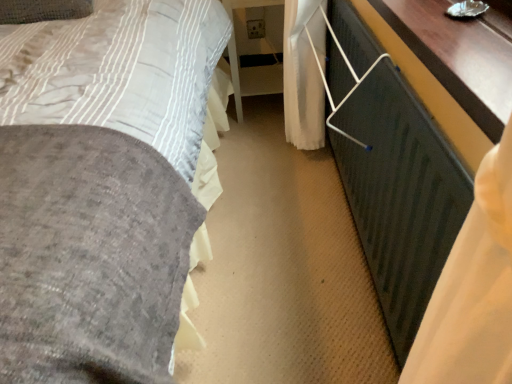
Question: Considering the relative positions of metallic silver balustrade at lower right and wooden table at right, which is the 2th table in left-to-right order, in the image provided, is metallic silver balustrade at lower right to the left of wooden table at right, which is the 2th table in left-to-right order, from the viewer's perspective?

Choices:
 (A) no
 (B) yes

Answer: (B)

Question: Does metallic silver balustrade at lower right turn towards wooden table at right, placed as the 1th table when sorted from front to back?

Choices:
 (A) no
 (B) yes

Answer: (A)

Question: Considering the relative sizes of metallic silver balustrade at lower right and wooden table at right, the first table when ordered from right to left, in the image provided, is metallic silver balustrade at lower right shorter than wooden table at right, the first table when ordered from right to left,?

Choices:
 (A) no
 (B) yes

Answer: (A)

Question: Is metallic silver balustrade at lower right positioned beyond the bounds of wooden table at right, which appears as the 2th table when viewed from the back?

Choices:
 (A) no
 (B) yes

Answer: (B)

Question: Is metallic silver balustrade at lower right closer to the viewer compared to wooden table at right, which is the 2th table in left-to-right order?

Choices:
 (A) no
 (B) yes

Answer: (B)

Question: Would you say metallic silver balustrade at lower right contains wooden table at right, the first table when ordered from right to left?

Choices:
 (A) yes
 (B) no

Answer: (B)

Question: From a real-world perspective, is white glossy table at center, the 1th table in the left-to-right sequence, positioned over wooden table at right, placed as the 1th table when sorted from front to back, based on gravity?

Choices:
 (A) no
 (B) yes

Answer: (A)

Question: Is white glossy table at center, the second table in the right-to-left sequence, shorter than wooden table at right, which is the 2th table in left-to-right order?

Choices:
 (A) no
 (B) yes

Answer: (A)

Question: Can you confirm if white glossy table at center, the 2th table when ordered from front to back, is smaller than wooden table at right, which is the 2th table in left-to-right order?

Choices:
 (A) yes
 (B) no

Answer: (B)

Question: Can you confirm if white glossy table at center, the 2th table when ordered from front to back, is bigger than wooden table at right, the first table when ordered from right to left?

Choices:
 (A) yes
 (B) no

Answer: (A)

Question: From the image's perspective, is white glossy table at center, which is the 1th table from back to front, on wooden table at right, which is the 2th table in left-to-right order?

Choices:
 (A) yes
 (B) no

Answer: (A)

Question: Would you say white glossy table at center, which is the 1th table from back to front, is outside wooden table at right, which appears as the 2th table when viewed from the back?

Choices:
 (A) no
 (B) yes

Answer: (B)

Question: Is wooden table at right, which appears as the 2th table when viewed from the back, smaller than metallic silver balustrade at lower right?

Choices:
 (A) yes
 (B) no

Answer: (A)